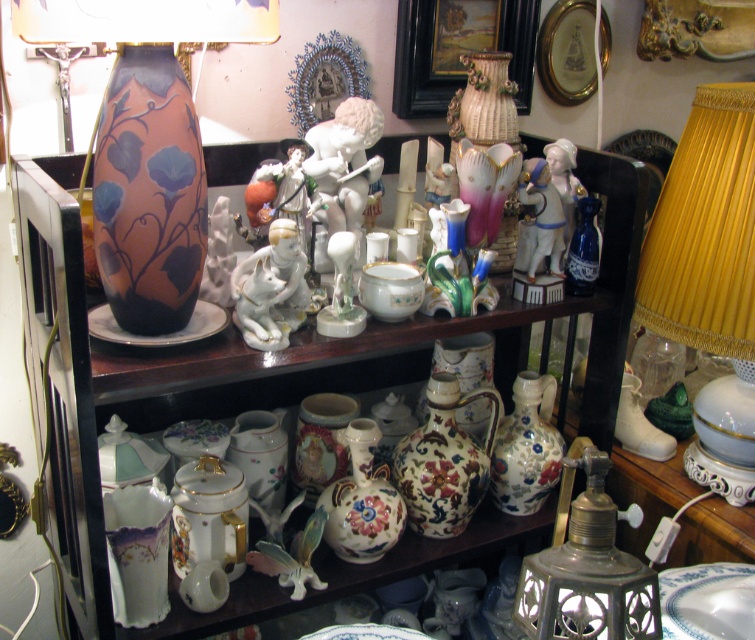
Question: Based on their relative distances, which object is farther from the gold pleated lampshade at right?

Choices:
 (A) matte ceramic vase at center-left
 (B) metallic brass lamp at lower right
 (C) matte ceramic vase at upper left

Answer: (A)

Question: Estimate the real-world distances between objects in this image. Which object is closer to the matte ceramic vase at upper left?

Choices:
 (A) matte ceramic vase at center-left
 (B) gold pleated lampshade at right
 (C) white glossy plate at lower right
 (D) metallic brass lamp at lower right

Answer: (A)

Question: Is matte ceramic vase at upper left smaller than matte ceramic plate at left?

Choices:
 (A) yes
 (B) no

Answer: (B)

Question: Does gold pleated lampshade at right have a smaller size compared to metallic brass lamp at lower right?

Choices:
 (A) no
 (B) yes

Answer: (A)

Question: Is matte ceramic vase at upper left to the left of matte ceramic plate at left from the viewer's perspective?

Choices:
 (A) no
 (B) yes

Answer: (A)

Question: Which point is farther to the camera?

Choices:
 (A) matte ceramic vase at upper left
 (B) metallic brass lamp at lower right
 (C) white glossy plate at lower right

Answer: (C)